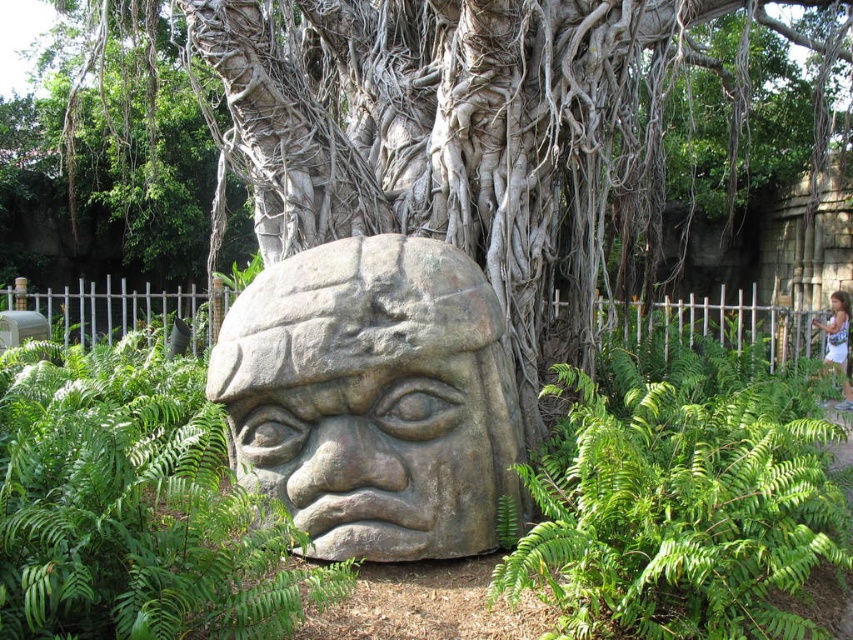
Does gray stone head at center lie in front of green leafy fern at center?

No.

Where is `gray stone head at center`? gray stone head at center is located at coordinates (372, 397).

Can you confirm if green leafy fern at center is smaller than white cotton shirt at lower right?

No, green leafy fern at center is not smaller than white cotton shirt at lower right.

In the scene shown: Is green leafy fern at center positioned behind white cotton shirt at lower right?

No, green leafy fern at center is in front of white cotton shirt at lower right.

The height and width of the screenshot is (640, 853). Describe the element at coordinates (135, 506) in the screenshot. I see `green leafy fern at center` at that location.

The height and width of the screenshot is (640, 853). Identify the location of green leafy fern at center. (135, 506).

Does white cotton shirt at lower right appear over smooth stone head at center?

Incorrect, white cotton shirt at lower right is not positioned above smooth stone head at center.

Between white cotton shirt at lower right and smooth stone head at center, which one has more height?

white cotton shirt at lower right is taller.

Does point (836, 301) lie behind point (831, 308)?

No, (836, 301) is in front of (831, 308).

Locate an element on the screen. white cotton shirt at lower right is located at coordinates (837, 342).